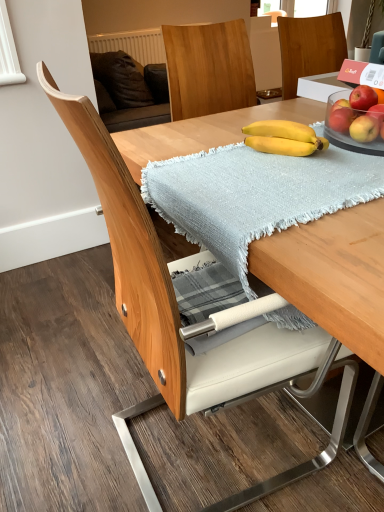
At what (x,y) coordinates should I click in order to perform the action: click on free space in front of yellow matte bananas at center. Please return your answer as a coordinate pair (x, y). The width and height of the screenshot is (384, 512). Looking at the image, I should click on (307, 180).